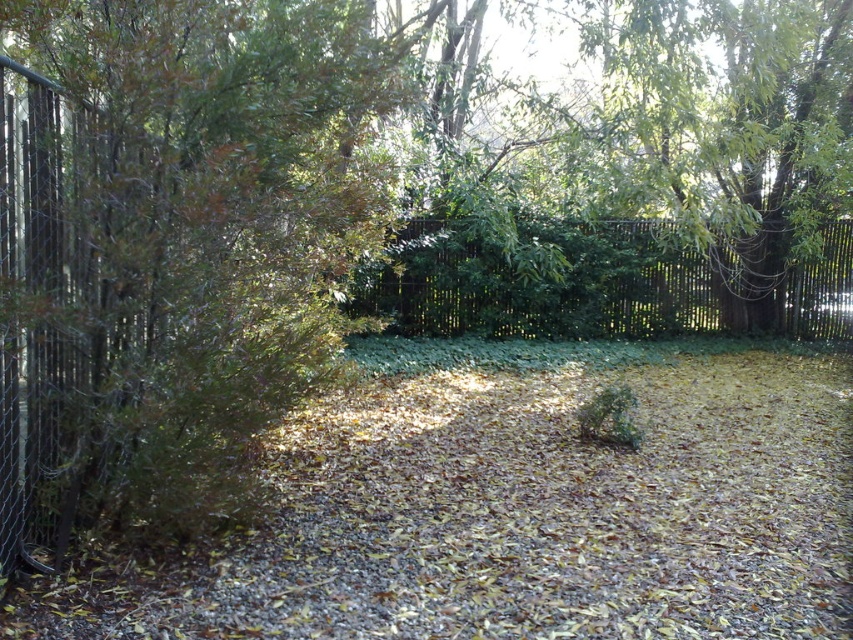
Question: Considering the real-world distances, which object is closest to the brown gravel path at center?

Choices:
 (A) green wooden fence at center
 (B) green leafy tree at left
 (C) metallic chain-link fence at left

Answer: (B)

Question: Which object is the closest to the green wooden fence at center?

Choices:
 (A) green leafy tree at left
 (B) brown gravel path at center
 (C) metallic chain-link fence at left

Answer: (B)

Question: Is brown gravel path at center thinner than metallic chain-link fence at left?

Choices:
 (A) yes
 (B) no

Answer: (B)

Question: Does green leafy tree at left lie in front of metallic chain-link fence at left?

Choices:
 (A) no
 (B) yes

Answer: (A)

Question: Considering the relative positions of brown gravel path at center and green wooden fence at center in the image provided, where is brown gravel path at center located with respect to green wooden fence at center?

Choices:
 (A) left
 (B) right

Answer: (A)

Question: Based on their relative distances, which object is nearer to the green leafy tree at left?

Choices:
 (A) green wooden fence at center
 (B) metallic chain-link fence at left

Answer: (B)